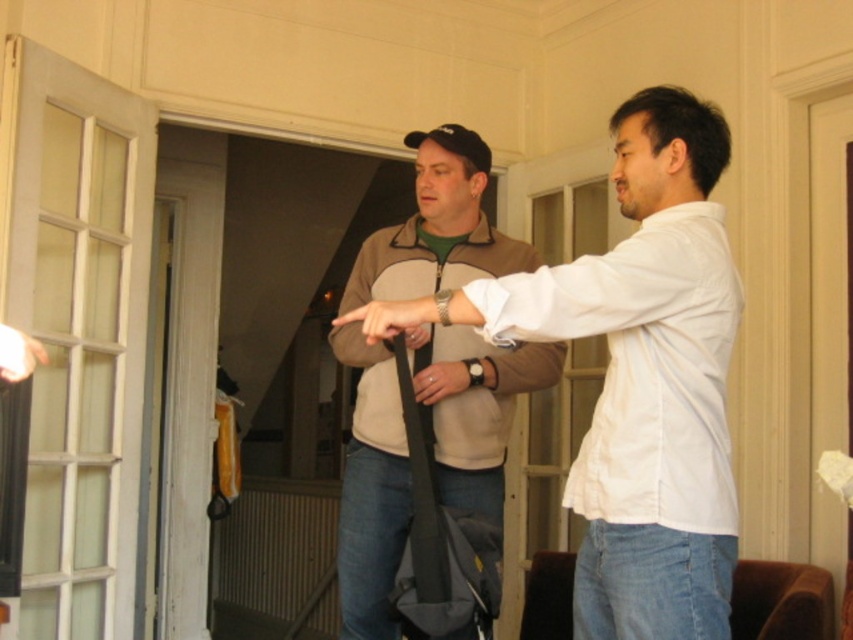
You are a delivery person trying to locate the black fabric strap at center and the matte black bag at center in the image. Which one is located to the left of the other?

The black fabric strap at center is positioned on the left side of matte black bag at center.

Consider the image. You are a delivery person trying to hand over a package to the person on the right. The package has a handle that must be placed exactly at point 0.850, 0.517. Where should you position the handle of the package so that it aligns with the black fabric strap at center?

The black fabric strap at center is located at point (440, 544), so you should position the handle of the package exactly at that coordinate to align with it.